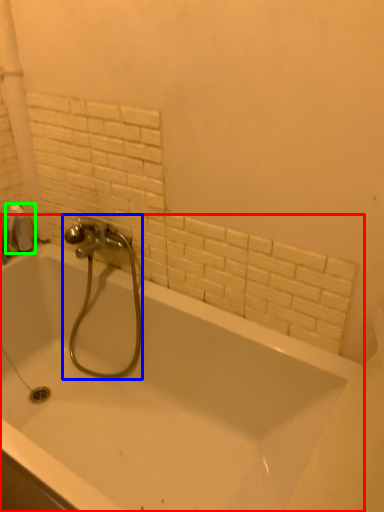
Question: Which object is the farthest from bathtub (highlighted by a red box)? Choose among these: tap (highlighted by a blue box) or toilet paper (highlighted by a green box).

Choices:
 (A) tap
 (B) toilet paper

Answer: (B)